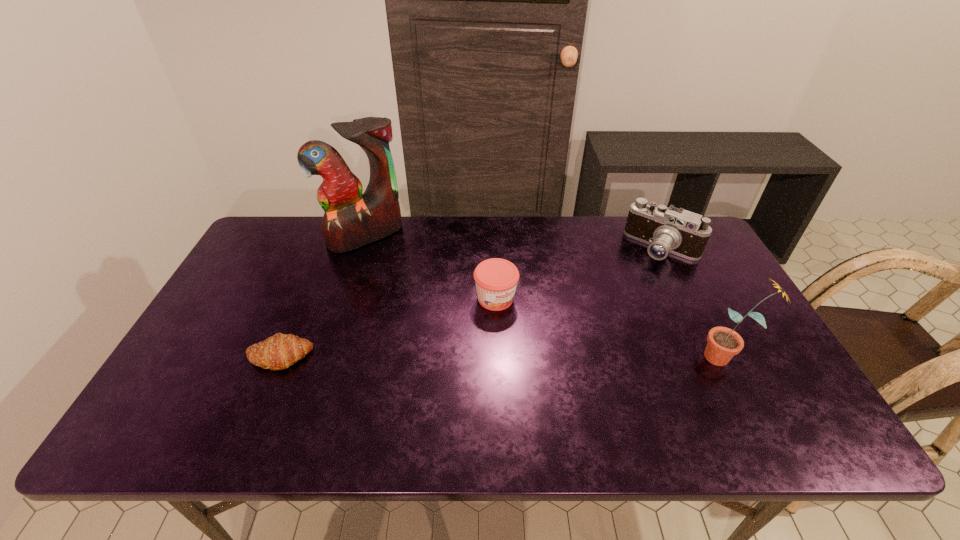
Find the location of a particular element. This screenshot has height=540, width=960. vacant area at the near left corner of the desktop is located at coordinates (190, 398).

Image resolution: width=960 pixels, height=540 pixels. In order to click on unoccupied position between the fourth tallest object and the tallest object in this screenshot , I will do `click(431, 267)`.

This screenshot has height=540, width=960. In order to click on free space that is in between the sunflower and the camera in this screenshot , I will do `click(694, 302)`.

The image size is (960, 540). Find the location of `free space between the fourth shortest object and the parrot`. free space between the fourth shortest object and the parrot is located at coordinates (545, 296).

Where is `vacant area between the camera and the third object from left to right`? vacant area between the camera and the third object from left to right is located at coordinates (579, 273).

Where is `empty space that is in between the camera and the parrot`? This screenshot has width=960, height=540. empty space that is in between the camera and the parrot is located at coordinates (515, 242).

I want to click on vacant area between the shortest object and the third tallest object, so click(x=470, y=302).

Where is `unoccupied position between the jam and the third shortest object`? This screenshot has height=540, width=960. unoccupied position between the jam and the third shortest object is located at coordinates (579, 273).

This screenshot has width=960, height=540. I want to click on vacant space that is in between the third shortest object and the shortest object, so click(470, 302).

Identify the location of vacant region between the second tallest object and the shortest object. This screenshot has width=960, height=540. (502, 356).